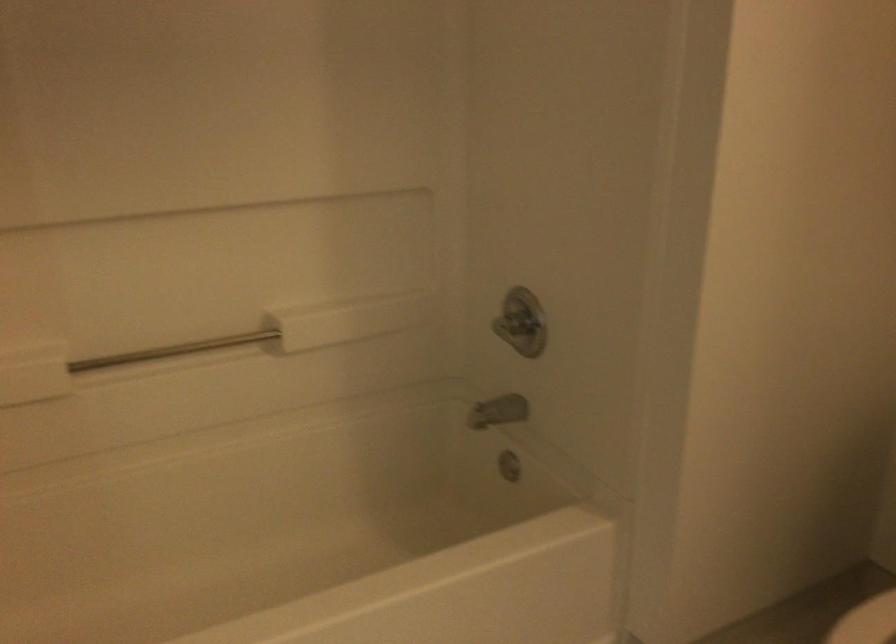
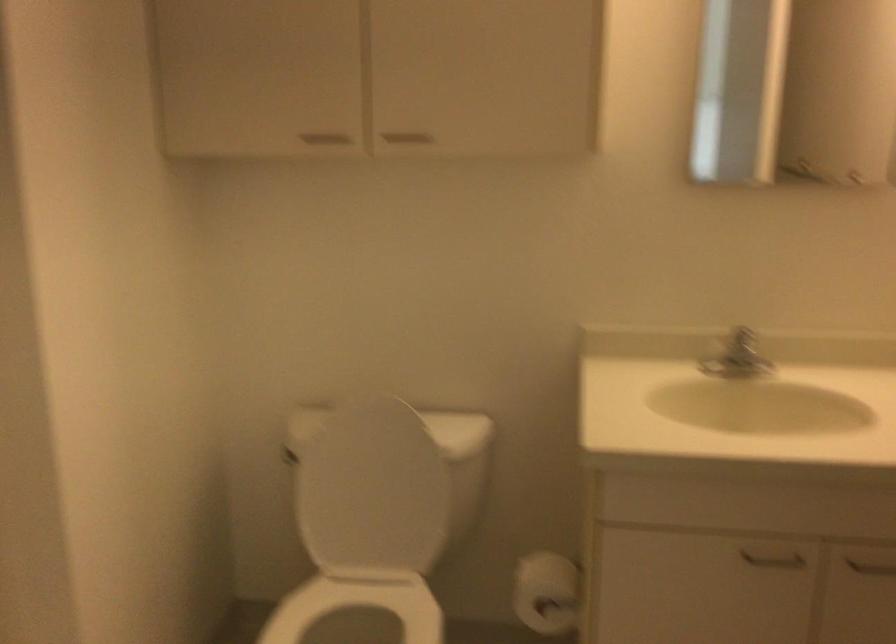
Question: The camera is either moving clockwise (left) or counter-clockwise (right) around the object. The first image is from the beginning of the video and the second image is from the end. Is the camera moving left or right when shooting the video?

Choices:
 (A) Left
 (B) Right

Answer: (A)